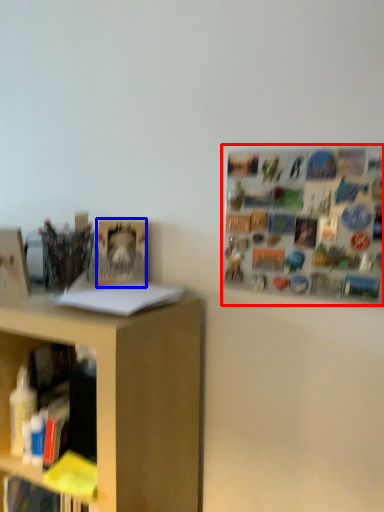
Question: Which point is closer to the camera, bulletin board (highlighted by a red box) or book (highlighted by a blue box)?

Choices:
 (A) bulletin board
 (B) book

Answer: (A)